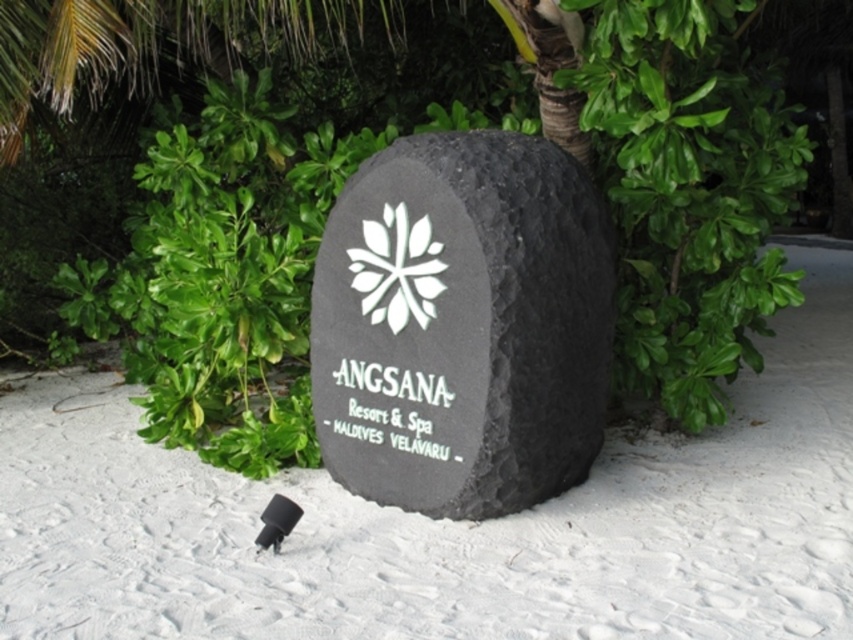
Between green leafy tree at center and white sand at center, which one is positioned lower?

Positioned lower is white sand at center.

Between green leafy tree at center and white sand at center, which one has more height?

green leafy tree at center

Does point (53, 333) lie behind point (26, 506)?

That is True.

Locate an element on the screen. green leafy tree at center is located at coordinates (672, 179).

Between green leafy tree at center and black stone sign at center, which one has less height?

black stone sign at center is shorter.

Does point (279, 218) come farther from viewer compared to point (585, 275)?

That is True.

Which is behind, point (584, 147) or point (334, 218)?

Point (584, 147)

This screenshot has height=640, width=853. Find the location of `green leafy tree at center`. green leafy tree at center is located at coordinates (672, 179).

Who is higher up, white sand at center or black stone sign at center?

black stone sign at center is above.

Is point (738, 515) behind point (511, 324)?

Yes.

At what (x,y) coordinates should I click in order to perform the action: click on white sand at center. Please return your answer as a coordinate pair (x, y). The width and height of the screenshot is (853, 640). Looking at the image, I should click on (448, 524).